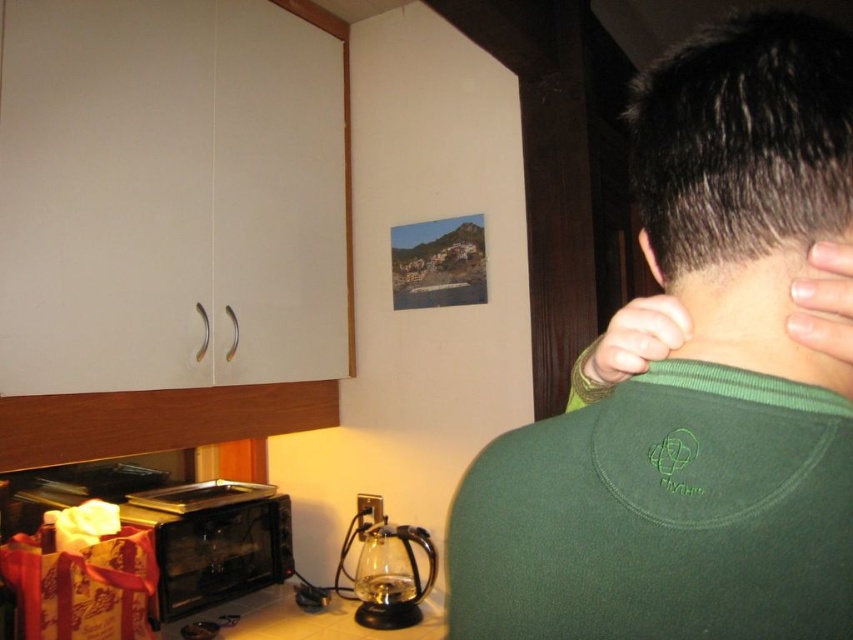
You are organizing items on the kitchen counter and notice the green fleece sweater at upper right and the green fabric hand at upper right. Which item takes up more horizontal space on the counter?

The green fleece sweater at upper right might be wider than green fabric hand at upper right, so it likely occupies more horizontal space on the counter.

You are organizing the kitchen and need to place the green fleece sweater at upper right and the black glass microwave at lower left. Which object is shorter and should be placed on a lower shelf to avoid blocking the microwave?

The green fleece sweater at upper right is shorter than the black glass microwave at lower left, so it should be placed on a lower shelf to avoid blocking the microwave.

You are a robotic assistant in a kitchen. You need to locate the green matte neck at center. Where is it positioned in the coordinate system provided?

The green matte neck at center is located at point coordinates (772,314).